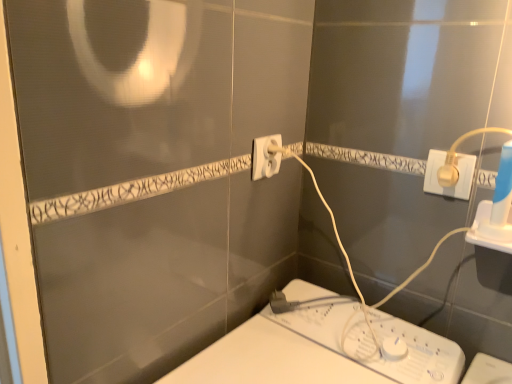
I want to click on white plastic plug at upper right, acting as the second power plugs and sockets starting from the back, so (x=457, y=179).

Describe the element at coordinates (457, 179) in the screenshot. I see `white plastic plug at upper right, positioned as the 2th power plugs and sockets in left-to-right order` at that location.

The height and width of the screenshot is (384, 512). I want to click on white plastic plug at center, the second power plugs and sockets when ordered from right to left, so click(x=266, y=156).

Measure the distance between point (252, 172) and camera.

The distance of point (252, 172) from camera is 33.82 inches.

Image resolution: width=512 pixels, height=384 pixels. What do you see at coordinates (266, 156) in the screenshot?
I see `white plastic plug at center, the second power plugs and sockets when ordered from right to left` at bounding box center [266, 156].

What are the coordinates of `white plastic plug at upper right, positioned as the 2th power plugs and sockets in left-to-right order` in the screenshot? It's located at (457, 179).

Does white plastic plug at center, the second power plugs and sockets when ordered from right to left, appear on the right side of white plastic plug at upper right, which is the first power plugs and sockets from front to back?

No, white plastic plug at center, the second power plugs and sockets when ordered from right to left, is not to the right of white plastic plug at upper right, which is the first power plugs and sockets from front to back.

Considering the positions of objects white plastic plug at center, which ranks as the second power plugs and sockets in front-to-back order, and white plastic plug at upper right, positioned as the 2th power plugs and sockets in left-to-right order, in the image provided, who is behind, white plastic plug at center, which ranks as the second power plugs and sockets in front-to-back order, or white plastic plug at upper right, positioned as the 2th power plugs and sockets in left-to-right order,?

white plastic plug at center, which ranks as the second power plugs and sockets in front-to-back order, is further away from the camera.

Does point (255, 172) appear closer or farther from the camera than point (467, 171)?

Point (255, 172) is farther from the camera than point (467, 171).

From the image's perspective, would you say white plastic plug at center, the first power plugs and sockets from the back, is positioned over white plastic plug at upper right, acting as the second power plugs and sockets starting from the back?

Correct, white plastic plug at center, the first power plugs and sockets from the back, appears higher than white plastic plug at upper right, acting as the second power plugs and sockets starting from the back, in the image.

From a real-world perspective, does white plastic plug at center, the first power plugs and sockets from the back, stand above white plastic plug at upper right, which is the first power plugs and sockets from front to back?

Yes.

Considering the sizes of objects white plastic plug at center, which ranks as the second power plugs and sockets in front-to-back order, and white plastic plug at upper right, which is the first power plugs and sockets from front to back, in the image provided, who is wider, white plastic plug at center, which ranks as the second power plugs and sockets in front-to-back order, or white plastic plug at upper right, which is the first power plugs and sockets from front to back,?

Wider between the two is white plastic plug at center, which ranks as the second power plugs and sockets in front-to-back order.

Does white plastic plug at center, which is counted as the 1th power plugs and sockets, starting from the left, have a greater height compared to white plastic plug at upper right, which is the first power plugs and sockets from front to back?

Correct, white plastic plug at center, which is counted as the 1th power plugs and sockets, starting from the left, is much taller as white plastic plug at upper right, which is the first power plugs and sockets from front to back.

Between white plastic plug at center, the first power plugs and sockets from the back, and white plastic plug at upper right, which is the 1th power plugs and sockets in right-to-left order, which one has larger size?

white plastic plug at center, the first power plugs and sockets from the back.

Does white plastic plug at center, which ranks as the second power plugs and sockets in front-to-back order, contain white plastic plug at upper right, which is the first power plugs and sockets from front to back?

No, white plastic plug at center, which ranks as the second power plugs and sockets in front-to-back order, does not contain white plastic plug at upper right, which is the first power plugs and sockets from front to back.

From the picture: Is the surface of white plastic plug at center, which is counted as the 1th power plugs and sockets, starting from the left, in direct contact with white plastic plug at upper right, positioned as the 2th power plugs and sockets in left-to-right order?

No, white plastic plug at center, which is counted as the 1th power plugs and sockets, starting from the left, is not making contact with white plastic plug at upper right, positioned as the 2th power plugs and sockets in left-to-right order.

Is white plastic plug at center, the second power plugs and sockets when ordered from right to left, positioned with its back to white plastic plug at upper right, which is the 1th power plugs and sockets in right-to-left order?

No, white plastic plug at center, the second power plugs and sockets when ordered from right to left, is not facing away from white plastic plug at upper right, which is the 1th power plugs and sockets in right-to-left order.

How different are the orientations of white plastic plug at center, which is counted as the 1th power plugs and sockets, starting from the left, and white plastic plug at upper right, acting as the second power plugs and sockets starting from the back, in degrees?

80.2 degrees.

In the image, there is a white plastic plug at center, the first power plugs and sockets from the back. Identify the location of power plugs and sockets below it (from the image's perspective). This screenshot has height=384, width=512. (457, 179).

Is white plastic plug at upper right, which is the 1th power plugs and sockets in right-to-left order, at the left side of white plastic plug at center, which ranks as the second power plugs and sockets in front-to-back order?

Incorrect, white plastic plug at upper right, which is the 1th power plugs and sockets in right-to-left order, is not on the left side of white plastic plug at center, which ranks as the second power plugs and sockets in front-to-back order.

Is the depth of white plastic plug at upper right, positioned as the 2th power plugs and sockets in left-to-right order, less than that of white plastic plug at center, which is counted as the 1th power plugs and sockets, starting from the left?

Yes, the depth of white plastic plug at upper right, positioned as the 2th power plugs and sockets in left-to-right order, is less than that of white plastic plug at center, which is counted as the 1th power plugs and sockets, starting from the left.

Is point (475, 163) in front of point (273, 138)?

Yes, point (475, 163) is in front of point (273, 138).

From the image's perspective, would you say white plastic plug at upper right, acting as the second power plugs and sockets starting from the back, is shown under white plastic plug at center, the second power plugs and sockets when ordered from right to left?

Yes, from the image's perspective, white plastic plug at upper right, acting as the second power plugs and sockets starting from the back, is below white plastic plug at center, the second power plugs and sockets when ordered from right to left.

From a real-world perspective, between white plastic plug at upper right, positioned as the 2th power plugs and sockets in left-to-right order, and white plastic plug at center, the first power plugs and sockets from the back, who is vertically higher?

white plastic plug at center, the first power plugs and sockets from the back, is physically above.

Which object is wider, white plastic plug at upper right, acting as the second power plugs and sockets starting from the back, or white plastic plug at center, which is counted as the 1th power plugs and sockets, starting from the left?

Wider between the two is white plastic plug at center, which is counted as the 1th power plugs and sockets, starting from the left.

From their relative heights in the image, would you say white plastic plug at upper right, which is the 1th power plugs and sockets in right-to-left order, is taller or shorter than white plastic plug at center, the first power plugs and sockets from the back?

Considering their sizes, white plastic plug at upper right, which is the 1th power plugs and sockets in right-to-left order, has less height than white plastic plug at center, the first power plugs and sockets from the back.

In terms of size, does white plastic plug at upper right, acting as the second power plugs and sockets starting from the back, appear bigger or smaller than white plastic plug at center, which ranks as the second power plugs and sockets in front-to-back order?

Clearly, white plastic plug at upper right, acting as the second power plugs and sockets starting from the back, is smaller in size than white plastic plug at center, which ranks as the second power plugs and sockets in front-to-back order.

Is white plastic plug at upper right, acting as the second power plugs and sockets starting from the back, outside of white plastic plug at center, which ranks as the second power plugs and sockets in front-to-back order?

That's correct, white plastic plug at upper right, acting as the second power plugs and sockets starting from the back, is outside of white plastic plug at center, which ranks as the second power plugs and sockets in front-to-back order.

Is there a large distance between white plastic plug at upper right, positioned as the 2th power plugs and sockets in left-to-right order, and white plastic plug at center, the first power plugs and sockets from the back?

white plastic plug at upper right, positioned as the 2th power plugs and sockets in left-to-right order, is actually quite close to white plastic plug at center, the first power plugs and sockets from the back.

Could you tell me if white plastic plug at upper right, which is the first power plugs and sockets from front to back, is facing white plastic plug at center, the first power plugs and sockets from the back?

No, white plastic plug at upper right, which is the first power plugs and sockets from front to back, is not facing towards white plastic plug at center, the first power plugs and sockets from the back.

Where is `power plugs and sockets to the left of white plastic plug at upper right, which is the 1th power plugs and sockets in right-to-left order`? power plugs and sockets to the left of white plastic plug at upper right, which is the 1th power plugs and sockets in right-to-left order is located at coordinates (266, 156).

Find the location of a particular element. This screenshot has height=384, width=512. power plugs and sockets on the left of white plastic plug at upper right, which is the 1th power plugs and sockets in right-to-left order is located at coordinates (266, 156).

This screenshot has height=384, width=512. I want to click on power plugs and sockets that appears in front of the white plastic plug at center, which ranks as the second power plugs and sockets in front-to-back order, so click(457, 179).